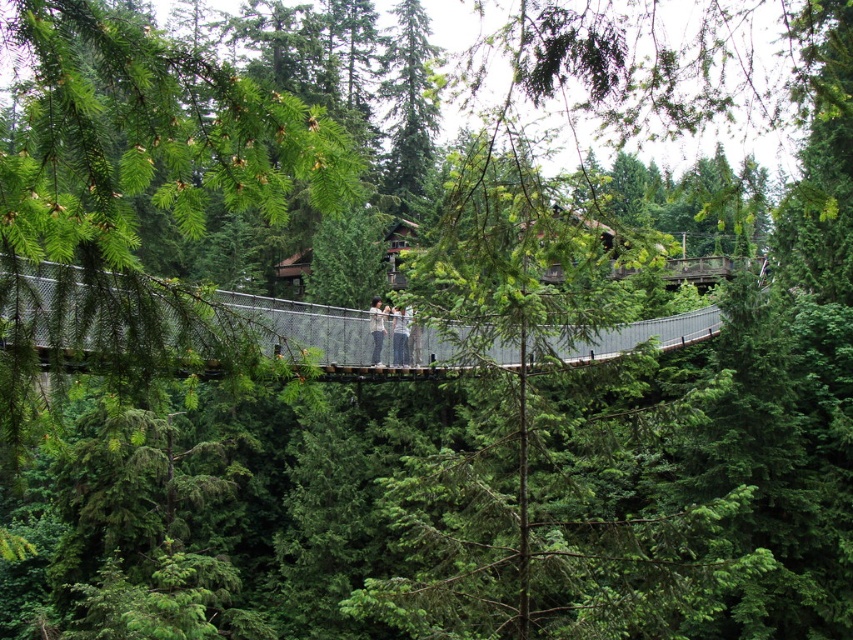
You are hiking in the forest and see a light gray fabric jacket at center. If you want to pick it up, which direction should you walk from your current position at point A, which is at the base of the nearest tree on the left side of the suspension bridge?

The light gray fabric jacket at center is located at point (399, 336), so you should walk towards the center of the bridge from point A to reach it.

You are hiking in the forest and see the metallic gray bridge at center and the light gray fabric jacket at center. Which object is closer to the ground?

The metallic gray bridge at center is positioned under the light gray fabric jacket at center, so the metallic gray bridge at center is closer to the ground.

Looking at this image, you are a hiker standing on the metallic gray bridge at center and looking towards the light gray fabric pants at center. Which object is closer to you?

The metallic gray bridge at center is closer to you than the light gray fabric pants at center.